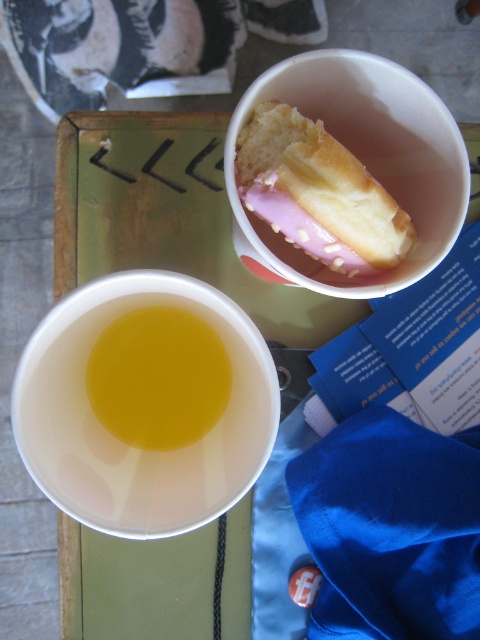
Who is more forward, (374,180) or (156,376)?

Point (374,180) is more forward.

Can you confirm if pink glazed donut at upper center is positioned below translucent yellow liquid at upper left?

Incorrect, pink glazed donut at upper center is not positioned below translucent yellow liquid at upper left.

Which is behind, point (242, 186) or point (95, 376)?

The point (95, 376) is more distant.

The width and height of the screenshot is (480, 640). I want to click on pink glazed donut at upper center, so click(x=317, y=193).